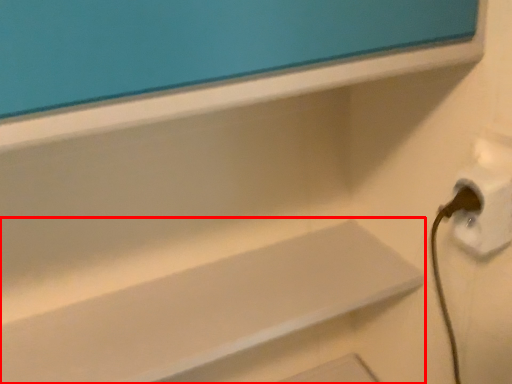
Question: Considering the relative positions of shelf (annotated by the red box) and electric outlet in the image provided, where is shelf (annotated by the red box) located with respect to the staircase?

Choices:
 (A) left
 (B) right

Answer: (A)